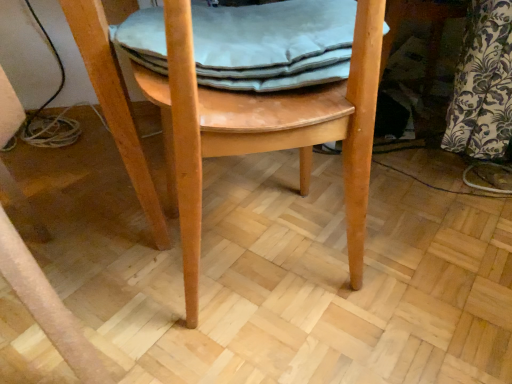
Measure the distance between light gray fabric cushion at center and camera.

light gray fabric cushion at center and camera are 61.90 centimeters apart from each other.

At what (x,y) coordinates should I click in order to perform the action: click on light gray fabric cushion at center. Please return your answer as a coordinate pair (x, y). Looking at the image, I should click on (273, 44).

This screenshot has height=384, width=512. What do you see at coordinates (273, 44) in the screenshot?
I see `light gray fabric cushion at center` at bounding box center [273, 44].

In order to face light gray fabric cushion at center, should I rotate leftwards or rightwards?

You should rotate left by 0.573 degrees.

The image size is (512, 384). Find the location of `light brown wood chair at center`. light brown wood chair at center is located at coordinates (266, 129).

What do you see at coordinates (266, 129) in the screenshot? I see `light brown wood chair at center` at bounding box center [266, 129].

What is the approximate height of light brown wood chair at center?

The height of light brown wood chair at center is 22.95 inches.

Where is `light gray fabric cushion at center`? light gray fabric cushion at center is located at coordinates (273, 44).

Which object is positioned more to the right, light gray fabric cushion at center or light brown wood chair at center?

Positioned to the right is light gray fabric cushion at center.

In the scene shown: Is light gray fabric cushion at center in front of or behind light brown wood chair at center in the image?

light gray fabric cushion at center is positioned farther from the viewer than light brown wood chair at center.

Does point (314, 70) come behind point (180, 118)?

Yes.

From the image's perspective, which object appears higher, light gray fabric cushion at center or light brown wood chair at center?

light gray fabric cushion at center is shown above in the image.

From a real-world perspective, is light gray fabric cushion at center physically below light brown wood chair at center?

No.

Looking at their sizes, would you say light gray fabric cushion at center is wider or thinner than light brown wood chair at center?

Considering their sizes, light gray fabric cushion at center looks slimmer than light brown wood chair at center.

Who is shorter, light gray fabric cushion at center or light brown wood chair at center?

light gray fabric cushion at center.

Can you confirm if light gray fabric cushion at center is smaller than light brown wood chair at center?

Correct, light gray fabric cushion at center occupies less space than light brown wood chair at center.

Would you say light gray fabric cushion at center is outside light brown wood chair at center?

No, light gray fabric cushion at center is inside or overlapping with light brown wood chair at center.

Is light gray fabric cushion at center next to light brown wood chair at center?

No, light gray fabric cushion at center is not touching light brown wood chair at center.

Looking at this image, is light gray fabric cushion at center aimed at light brown wood chair at center?

Yes.

Locate an element on the screen. Image resolution: width=512 pixels, height=384 pixels. material behind the light brown wood chair at center is located at coordinates (273, 44).

Does light brown wood chair at center appear on the right side of light gray fabric cushion at center?

No.

Relative to light gray fabric cushion at center, is light brown wood chair at center in front or behind?

In the image, light brown wood chair at center appears in front of light gray fabric cushion at center.

Does point (266, 125) lie in front of point (251, 65)?

Yes, it is.

From the image's perspective, between light brown wood chair at center and light gray fabric cushion at center, which one is located above?

From the image's view, light gray fabric cushion at center is above.

From a real-world perspective, is light brown wood chair at center positioned under light gray fabric cushion at center based on gravity?

Yes, from a real-world perspective, light brown wood chair at center is under light gray fabric cushion at center.

Considering the relative sizes of light brown wood chair at center and light gray fabric cushion at center in the image provided, is light brown wood chair at center wider than light gray fabric cushion at center?

Indeed, light brown wood chair at center has a greater width compared to light gray fabric cushion at center.

Considering the sizes of objects light brown wood chair at center and light gray fabric cushion at center in the image provided, who is taller, light brown wood chair at center or light gray fabric cushion at center?

Standing taller between the two is light brown wood chair at center.

Looking at this image, looking at the image, does light brown wood chair at center seem bigger or smaller compared to light gray fabric cushion at center?

Considering their sizes, light brown wood chair at center takes up more space than light gray fabric cushion at center.

Is light brown wood chair at center not inside light gray fabric cushion at center?

That's correct, light brown wood chair at center is outside of light gray fabric cushion at center.

Is light brown wood chair at center touching light gray fabric cushion at center?

No, light brown wood chair at center is not in contact with light gray fabric cushion at center.

Is light brown wood chair at center aimed at light gray fabric cushion at center?

Yes, light brown wood chair at center is aimed at light gray fabric cushion at center.

What's the angular difference between light brown wood chair at center and light gray fabric cushion at center's facing directions?

5.76e-05 degrees.

This screenshot has width=512, height=384. What are the coordinates of `material lying behind the light brown wood chair at center` in the screenshot? It's located at (273, 44).

Identify the location of material that is above the light brown wood chair at center (from a real-world perspective). (273, 44).

The width and height of the screenshot is (512, 384). I want to click on chair lying below the light gray fabric cushion at center (from the image's perspective), so 266,129.